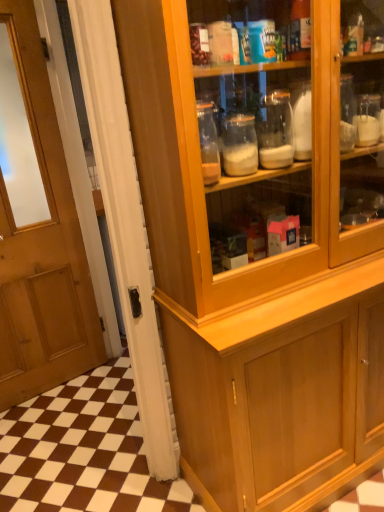
Question: Is point (304, 317) closer or farther from the camera than point (21, 316)?

Choices:
 (A) farther
 (B) closer

Answer: (B)

Question: From a real-world perspective, is wooden cabinet at lower right physically located above or below wooden door at left?

Choices:
 (A) above
 (B) below

Answer: (B)

Question: Is wooden cabinet at lower right in front of or behind wooden door at left in the image?

Choices:
 (A) front
 (B) behind

Answer: (B)

Question: Looking at the image, does wooden door at left seem bigger or smaller compared to wooden cabinet at lower right?

Choices:
 (A) big
 (B) small

Answer: (B)

Question: From the image's perspective, is wooden door at left located above or below wooden cabinet at lower right?

Choices:
 (A) above
 (B) below

Answer: (A)

Question: Considering the positions of wooden door at left and wooden cabinet at lower right in the image, is wooden door at left wider or thinner than wooden cabinet at lower right?

Choices:
 (A) thin
 (B) wide

Answer: (A)

Question: Is wooden door at left inside or outside of wooden cabinet at lower right?

Choices:
 (A) outside
 (B) inside

Answer: (A)